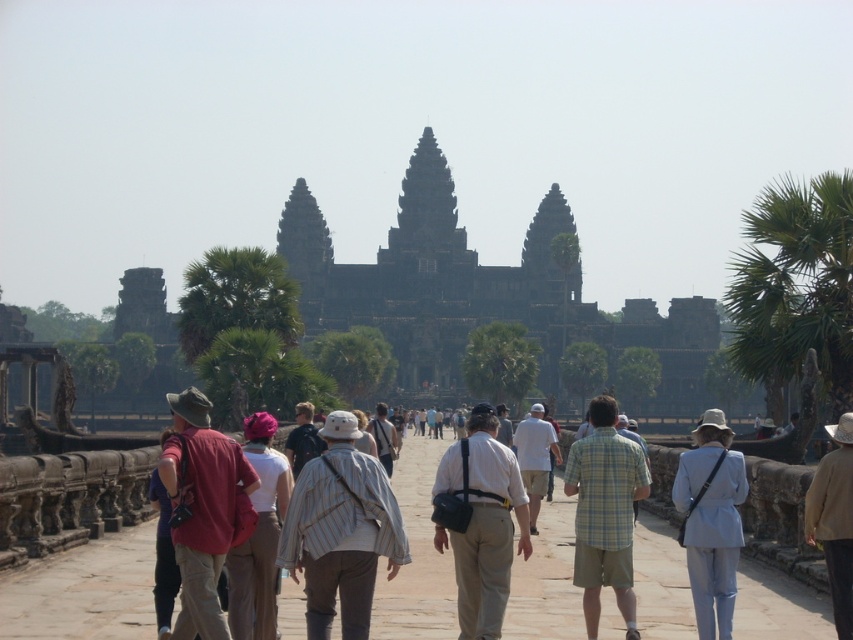
Measure the distance from beige fabric hat at upper center to striped shirt at center.

They are 39.64 meters apart.

Where is `beige fabric hat at upper center`? The image size is (853, 640). beige fabric hat at upper center is located at coordinates (834, 520).

Is light blue fabric coat at center-right smaller than khaki pants at center?

No.

Is light blue fabric coat at center-right further to the viewer compared to khaki pants at center?

Yes, light blue fabric coat at center-right is further from the viewer.

Who is more distant from viewer, (704, 424) or (259, 458)?

The point (704, 424) is behind.

Identify the location of light blue fabric coat at center-right. (711, 522).

Which is behind, point (250, 616) or point (387, 436)?

Positioned behind is point (387, 436).

Who is higher up, khaki pants at center or striped shirt at center?

striped shirt at center is above.

The image size is (853, 640). Describe the element at coordinates (259, 536) in the screenshot. I see `khaki pants at center` at that location.

The height and width of the screenshot is (640, 853). Find the location of `khaki pants at center`. khaki pants at center is located at coordinates (259, 536).